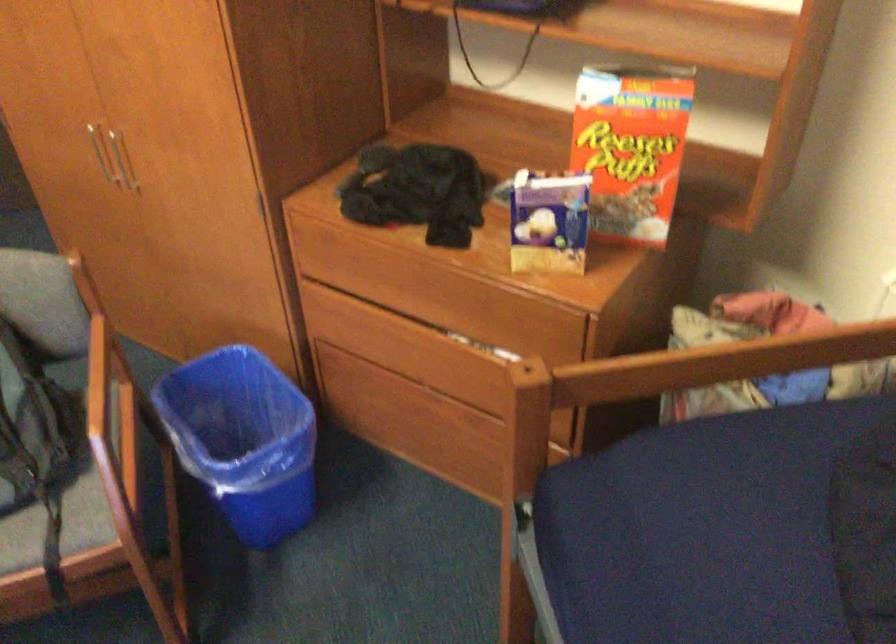
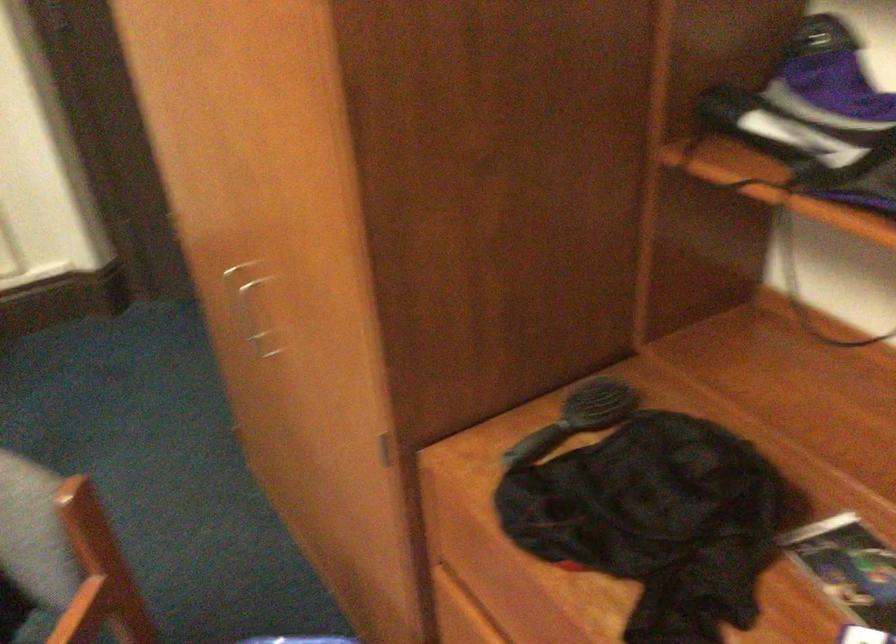
Question: The first image is from the beginning of the video and the second image is from the end. How did the camera likely rotate when shooting the video?

Choices:
 (A) Left
 (B) Right
 (C) Up
 (D) Down

Answer: (A)